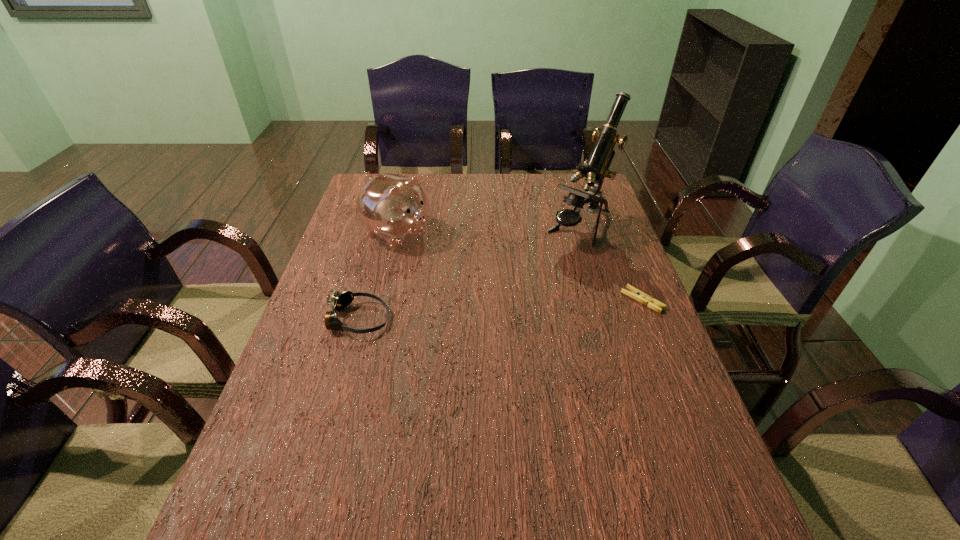
I want to click on vacant space located through the eyepiece of the microscope, so click(484, 317).

This screenshot has width=960, height=540. Find the location of `vacant point located 0.390m through the eyepiece of the microscope`. vacant point located 0.390m through the eyepiece of the microscope is located at coordinates (484, 317).

Find the location of a particular element. goggles that is positioned at the left edge is located at coordinates (339, 301).

You are a GUI agent. You are given a task and a screenshot of the screen. Output one action in this format:
    pyautogui.click(x=<x>, y=<y>)
    Task: Click on the piggy bank that is at the left edge
    The width and height of the screenshot is (960, 540).
    Given the screenshot: What is the action you would take?
    pyautogui.click(x=394, y=207)

I want to click on clothespin that is positioned at the right edge, so click(636, 294).

The height and width of the screenshot is (540, 960). Find the location of `microscope at the right edge`. microscope at the right edge is located at coordinates (596, 168).

Identify the location of vacant region at the far edge. This screenshot has height=540, width=960. (553, 176).

Identify the location of vacant region at the near edge of the desktop. The width and height of the screenshot is (960, 540). (361, 460).

In the image, there is a desktop. What are the coordinates of `vacant space at the left edge` in the screenshot? It's located at (279, 453).

Find the location of a particular element. The image size is (960, 540). free space at the right edge of the desktop is located at coordinates (626, 396).